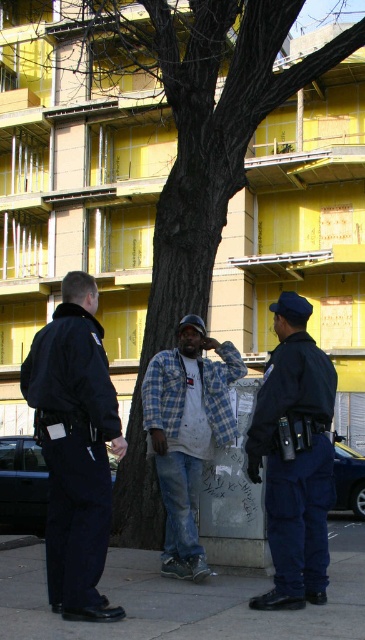
Question: Is dark blue uniform at center closer to the viewer compared to blue uniformed officer at center?

Choices:
 (A) no
 (B) yes

Answer: (B)

Question: Among these objects, which one is farthest from the camera?

Choices:
 (A) plaid fabric shirt at center
 (B) gray concrete sidewalk at center
 (C) blue uniformed officer at center

Answer: (A)

Question: Can you confirm if dark blue uniform at center is positioned above blue uniformed officer at center?

Choices:
 (A) no
 (B) yes

Answer: (B)

Question: Is dark blue uniform at center closer to camera compared to blue uniformed officer at center?

Choices:
 (A) no
 (B) yes

Answer: (B)

Question: Estimate the real-world distances between objects in this image. Which object is closer to the plaid fabric shirt at center?

Choices:
 (A) blue uniformed officer at center
 (B) gray concrete sidewalk at center
 (C) dark blue uniform at center

Answer: (A)

Question: Which point is closer to the camera?

Choices:
 (A) plaid fabric shirt at center
 (B) dark blue uniform at center
 (C) blue uniformed officer at center
 (D) gray concrete sidewalk at center

Answer: (D)